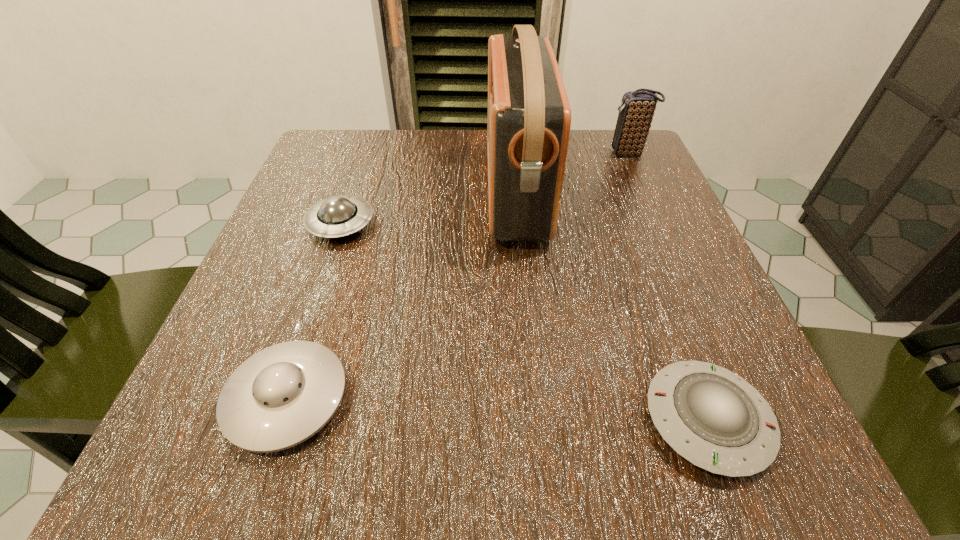
Find the location of a particular element. blank space located 0.250m with the zip open on the clutch bag is located at coordinates (494, 154).

Identify the location of vacant space located 0.280m with the zip open on the clutch bag. (481, 154).

Find the location of a particular element. free point located 0.090m on the right of the farthest saucer is located at coordinates (424, 224).

The width and height of the screenshot is (960, 540). I want to click on free point located 0.080m on the left of the shortest object, so click(x=581, y=420).

Image resolution: width=960 pixels, height=540 pixels. Find the location of `radio receiver that is at the far edge`. radio receiver that is at the far edge is located at coordinates point(529,117).

Identify the location of clutch bag that is at the far edge. Image resolution: width=960 pixels, height=540 pixels. (636, 111).

You are a GUI agent. You are given a task and a screenshot of the screen. Output one action in this format:
    pyautogui.click(x=<x>, y=<y>)
    Task: Click on the clutch bag that is at the right edge
    The height and width of the screenshot is (540, 960).
    Given the screenshot: What is the action you would take?
    pyautogui.click(x=636, y=111)

The width and height of the screenshot is (960, 540). I want to click on saucer that is at the right edge, so click(713, 418).

In order to click on object that is at the near left corner in this screenshot , I will do `click(281, 396)`.

Image resolution: width=960 pixels, height=540 pixels. What are the coordinates of `object located at the far right corner` in the screenshot? It's located at (636, 111).